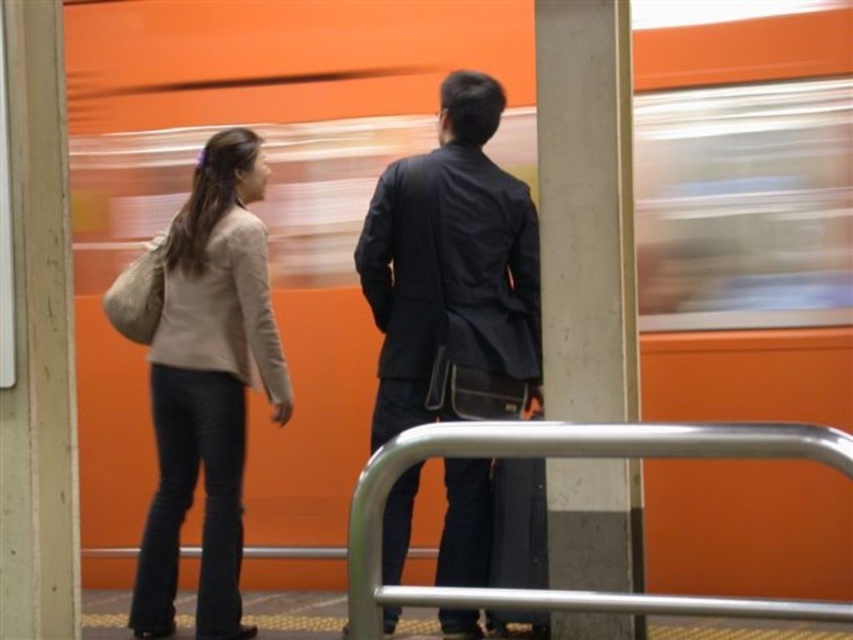
The height and width of the screenshot is (640, 853). Describe the element at coordinates (451, 273) in the screenshot. I see `matte black jacket at center` at that location.

What do you see at coordinates (451, 273) in the screenshot? This screenshot has width=853, height=640. I see `matte black jacket at center` at bounding box center [451, 273].

Find the location of a particular element. The width and height of the screenshot is (853, 640). matte black jacket at center is located at coordinates (451, 273).

Who is lower down, matte black jacket at center or silver metallic rail at center?

silver metallic rail at center

At what (x,y) coordinates should I click in order to perform the action: click on matte black jacket at center. Please return your answer as a coordinate pair (x, y). The width and height of the screenshot is (853, 640). Looking at the image, I should click on (451, 273).

Find the location of a particular element. The width and height of the screenshot is (853, 640). matte black jacket at center is located at coordinates (451, 273).

Can you confirm if matte black jacket at center is positioned to the left of beige fabric sweater at left?

Incorrect, matte black jacket at center is not on the left side of beige fabric sweater at left.

Between point (467, 272) and point (161, 291), which one is positioned in front?

Point (467, 272) is more forward.

You are a GUI agent. You are given a task and a screenshot of the screen. Output one action in this format:
    pyautogui.click(x=<x>, y=<y>)
    Task: Click on the matte black jacket at center
    The image size is (853, 640).
    Given the screenshot: What is the action you would take?
    pyautogui.click(x=451, y=273)